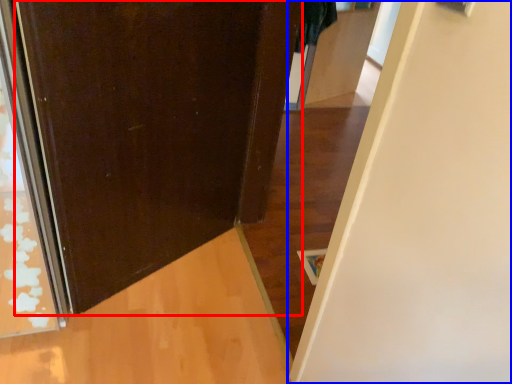
Question: Which object is further to the camera taking this photo, door (highlighted by a red box) or door (highlighted by a blue box)?

Choices:
 (A) door
 (B) door

Answer: (A)